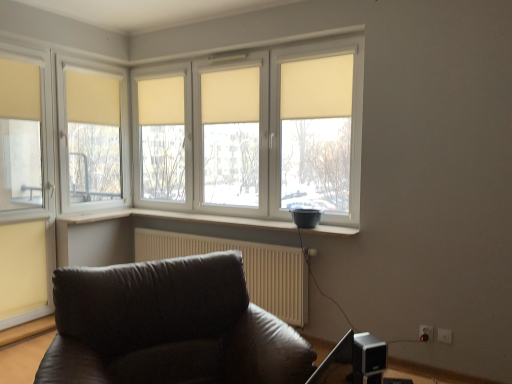
Find the location of a particular element. The width and height of the screenshot is (512, 384). free spot above beige fabric curtain at upper left, the second curtain in the left-to-right sequence (from a real-world perspective) is located at coordinates (92, 70).